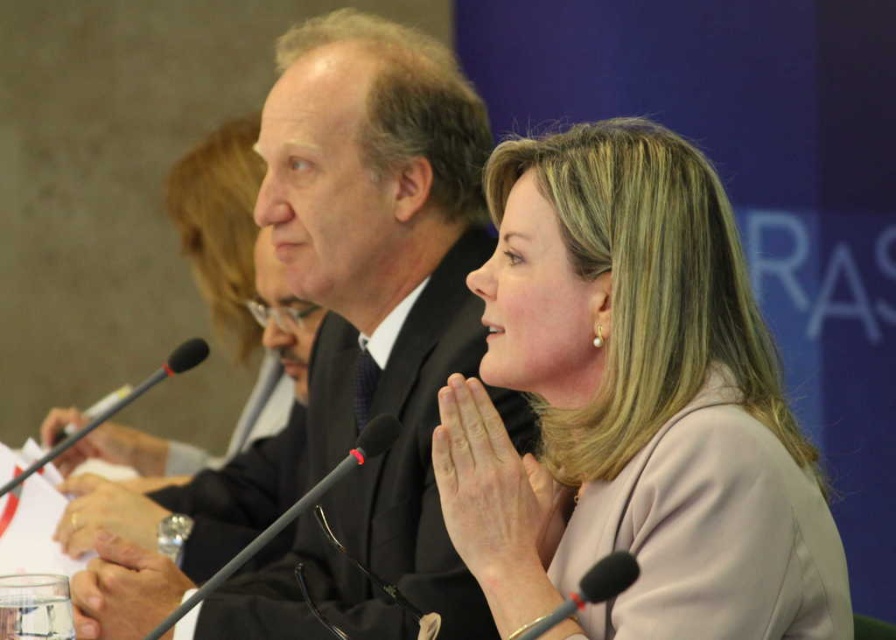
Question: From the image, what is the correct spatial relationship of matte black suit at center in relation to black plastic microphone at lower left?

Choices:
 (A) above
 (B) below

Answer: (A)

Question: Which object is the closest to the black matte microphone at lower center?

Choices:
 (A) matte black suit at center
 (B) pink fabric at center

Answer: (B)

Question: Does black matte microphone at center have a lesser width compared to black plastic microphone at lower left?

Choices:
 (A) no
 (B) yes

Answer: (B)

Question: Among these points, which one is nearest to the camera?

Choices:
 (A) (390, 417)
 (B) (765, 424)
 (C) (596, 570)

Answer: (C)

Question: Among these objects, which one is farthest from the camera?

Choices:
 (A) black matte microphone at center
 (B) pink fabric at center
 (C) matte black suit at center
 (D) black matte microphone at lower center

Answer: (C)

Question: Does pink fabric at center have a lesser width compared to black matte microphone at center?

Choices:
 (A) yes
 (B) no

Answer: (B)